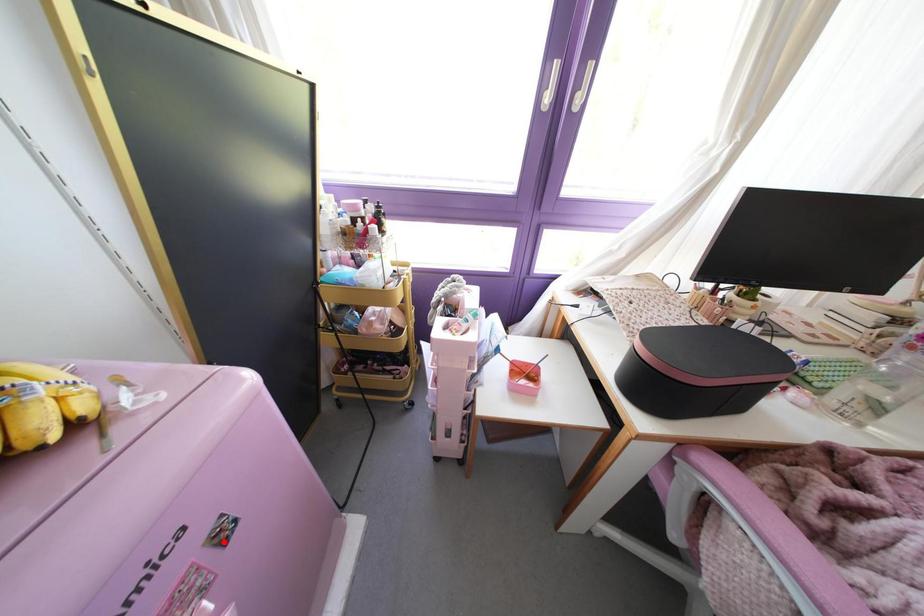
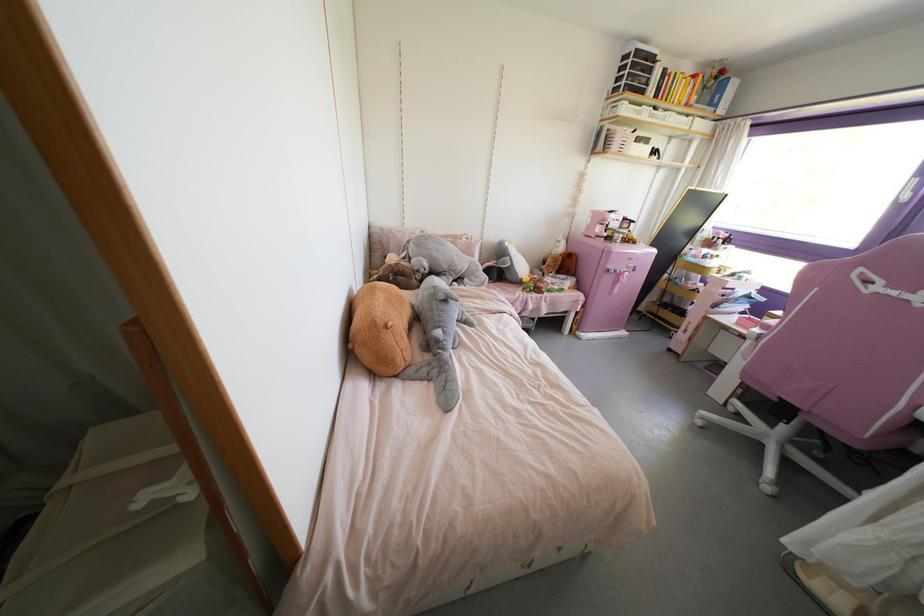
In the second image, find the point that corresponds to the highlighted location in the first image.

(633, 270)